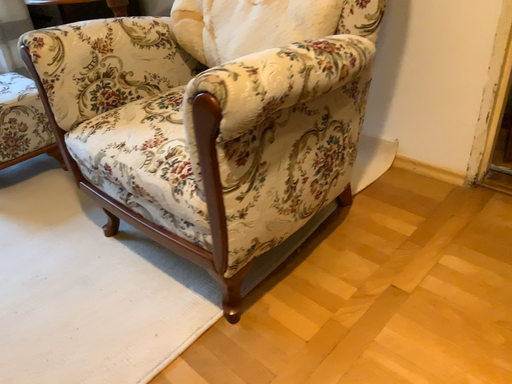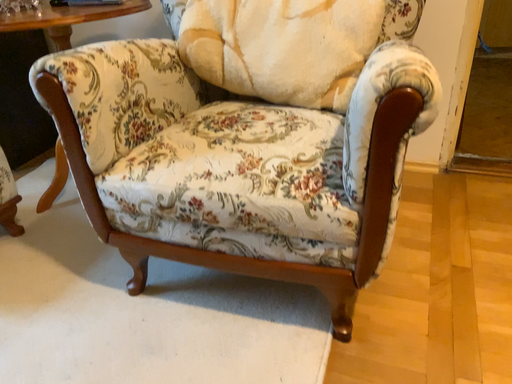
Question: Which way did the camera rotate in the video?

Choices:
 (A) rotated upward
 (B) rotated downward

Answer: (A)